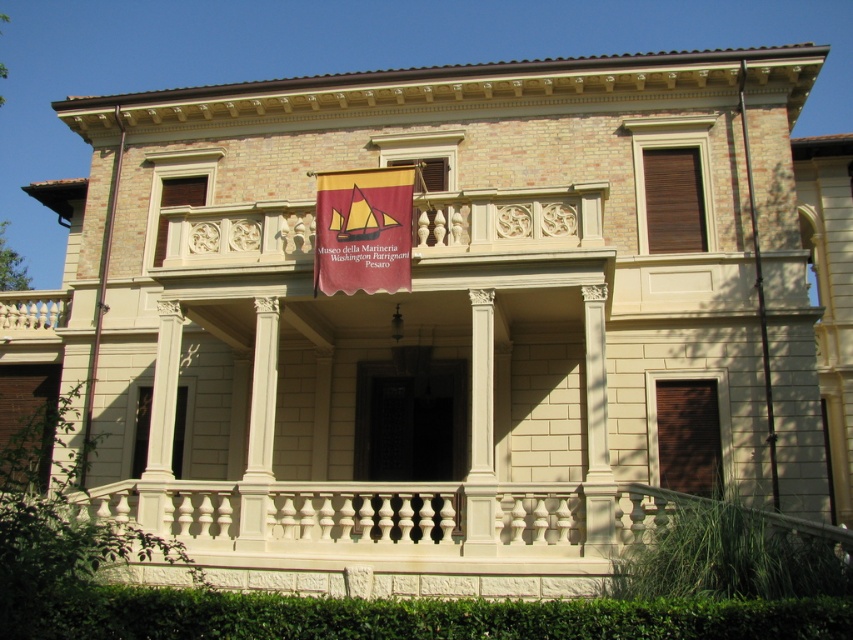
Who is more distant from viewer, [206,220] or [355,202]?

The point [206,220] is more distant.

Is white stone balcony at center further to the viewer compared to maroon fabric banner at center?

Yes, white stone balcony at center is behind maroon fabric banner at center.

Find the location of a particular element. The width and height of the screenshot is (853, 640). white stone balcony at center is located at coordinates tap(508, 220).

Where is `white stone balcony at center`? The height and width of the screenshot is (640, 853). white stone balcony at center is located at coordinates pyautogui.click(x=508, y=220).